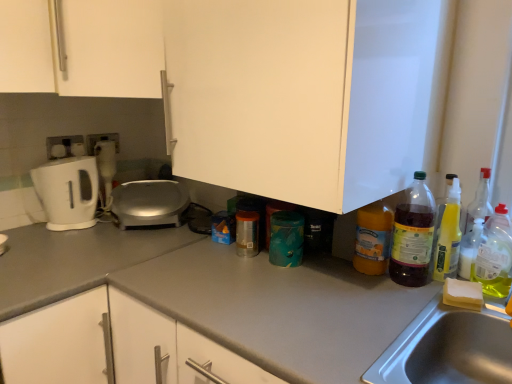
At what (x,y) coordinates should I click in order to perform the action: click on vacant space in front of orange matte bottle at lower right, arranged as the 5th bottle when viewed from the right. Please return your answer as a coordinate pair (x, y). This screenshot has width=512, height=384. Looking at the image, I should click on (373, 294).